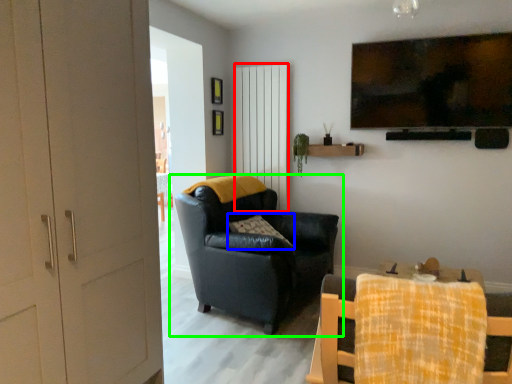
Question: Estimate the real-world distances between objects in this image. Which object is closer to curtain (highlighted by a red box), pillow (highlighted by a blue box) or chair (highlighted by a green box)?

Choices:
 (A) pillow
 (B) chair

Answer: (B)